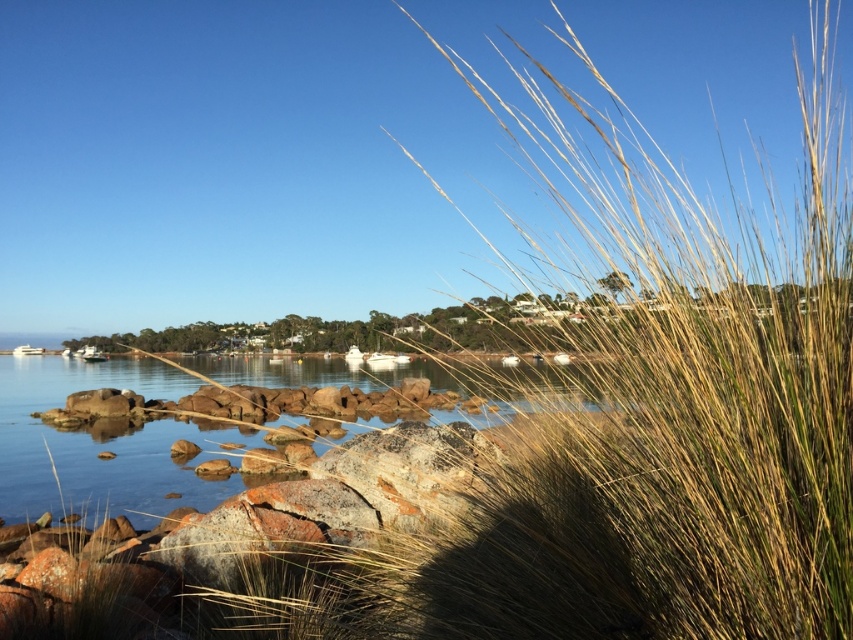
You are standing at the edge of the coastal scene and want to place a small flag at each of the two points marked in the image. The first point is at coordinates point (x=782, y=522) and the second is at point (x=370, y=317). Which flag will you place closer to your current position?

The point (x=782, y=522) is closer to the viewer than point (x=370, y=317), so you should place the flag at point (x=782, y=522) closer to your current position.

You are a hiker who wants to cross the water area between the dry grass at center and the golden grass at center. Which grass is shorter and can you step on it to cross?

The dry grass at center is shorter than the golden grass at center, so you can step on it to cross.

You are a photographer trying to capture the dry grass at center and golden grass at center in a single shot. Based on their positions, which grass type will appear closer to the camera in the photo?

The dry grass at center will appear closer to the camera because it is positioned in front of the golden grass at center.